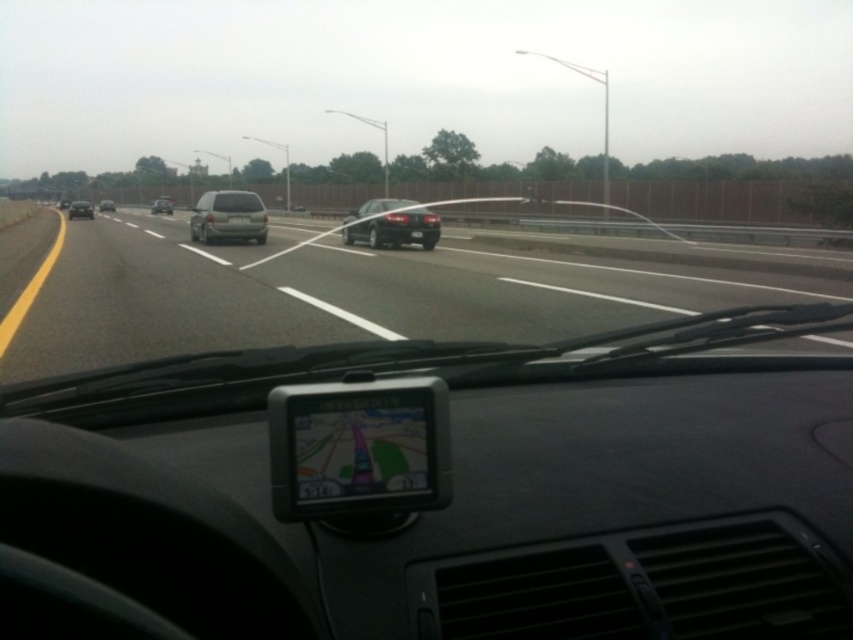
Between shiny black sedan at center and silver metallic sedan at center, which one is positioned higher?

silver metallic sedan at center is higher up.

Who is positioned more to the left, shiny black sedan at center or silver metallic sedan at center?

silver metallic sedan at center

At what (x,y) coordinates should I click in order to perform the action: click on shiny black sedan at center. Please return your answer as a coordinate pair (x, y). The image size is (853, 640). Looking at the image, I should click on (392, 225).

Can you confirm if shiny black sedan at center is thinner than satin silver suv at center?

Indeed, shiny black sedan at center has a lesser width compared to satin silver suv at center.

The height and width of the screenshot is (640, 853). I want to click on shiny black sedan at center, so click(392, 225).

Identify the location of shiny black sedan at center. (392, 225).

Can you confirm if satin silver minivan at center is positioned to the right of matte gray car at center?

Incorrect, satin silver minivan at center is not on the right side of matte gray car at center.

What do you see at coordinates (228, 216) in the screenshot? Image resolution: width=853 pixels, height=640 pixels. I see `satin silver minivan at center` at bounding box center [228, 216].

Where is `satin silver minivan at center`? The width and height of the screenshot is (853, 640). satin silver minivan at center is located at coordinates (228, 216).